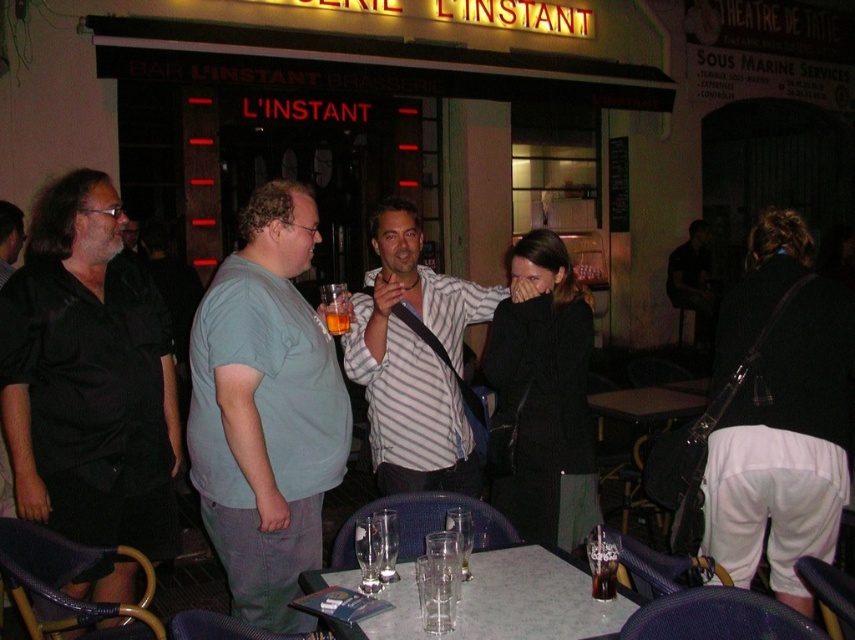
The image size is (855, 640). Identify the location of light blue t-shirt at center. (264, 410).

This screenshot has height=640, width=855. Describe the element at coordinates (264, 410) in the screenshot. I see `light blue t-shirt at center` at that location.

Where is `light blue t-shirt at center`? light blue t-shirt at center is located at coordinates (264, 410).

Is point (388, 570) positioned before point (332, 316)?

That is True.

Who is more distant from viewer, (391, 524) or (326, 300)?

The point (326, 300) is more distant.

Where is `clear glass at table center`? clear glass at table center is located at coordinates (387, 544).

Is white marble table at center thinner than clear glass wine glass at table center?

No.

Which of these two, white marble table at center or clear glass wine glass at table center, stands taller?

clear glass wine glass at table center

Is point (594, 625) less distant than point (379, 561)?

Yes.

What are the coordinates of `white marble table at center` in the screenshot? It's located at (502, 602).